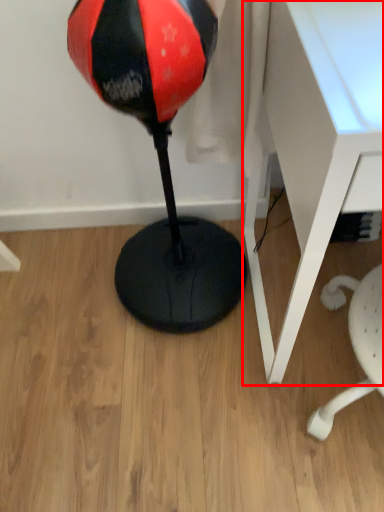
Question: From the image, what is the correct spatial relationship of table (annotated by the red box) in relation to bean bag chair?

Choices:
 (A) left
 (B) right

Answer: (B)